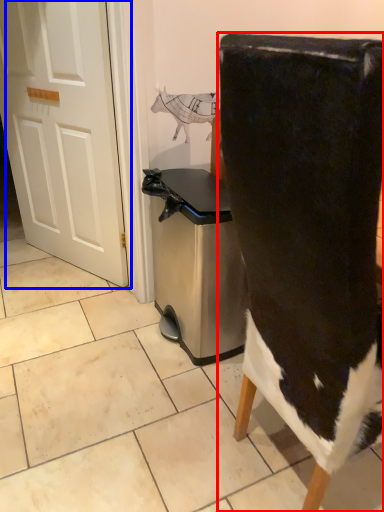
Question: Which point is further to the camera, chair (highlighted by a red box) or door (highlighted by a blue box)?

Choices:
 (A) chair
 (B) door

Answer: (B)